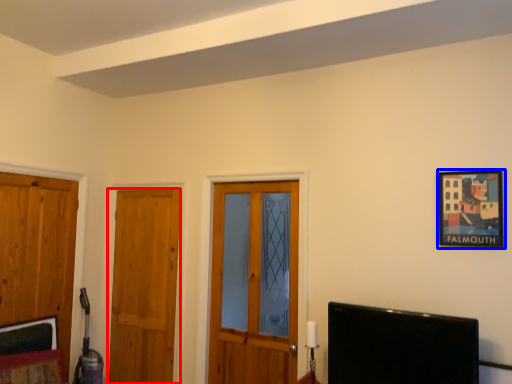
Question: Which of the following is the closest to the observer, door (highlighted by a red box) or picture frame (highlighted by a blue box)?

Choices:
 (A) door
 (B) picture frame

Answer: (B)